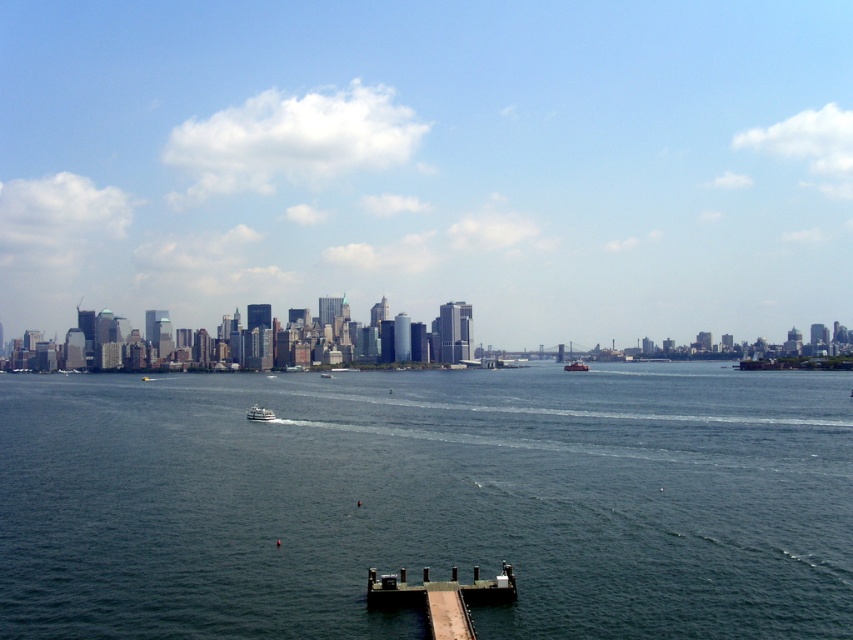
Who is taller, dark blue water at center or metallic gray ship at center?

Standing taller between the two is dark blue water at center.

How far apart are dark blue water at center and metallic gray ship at center?

dark blue water at center is 710.25 feet away from metallic gray ship at center.

The image size is (853, 640). Identify the location of dark blue water at center. (427, 500).

Is point (367, 424) farther from viewer compared to point (254, 406)?

That is False.

Is dark blue water at center below white glossy ferry at center?

No.

Which is in front, point (724, 468) or point (270, 410)?

Point (724, 468)

At what (x,y) coordinates should I click in order to perform the action: click on dark blue water at center. Please return your answer as a coordinate pair (x, y). This screenshot has width=853, height=640. Looking at the image, I should click on (427, 500).

Does brown wooden dock at lower center appear on the right side of white glossy ferry at center?

Yes, brown wooden dock at lower center is to the right of white glossy ferry at center.

Can you confirm if brown wooden dock at lower center is positioned below white glossy ferry at center?

Correct, brown wooden dock at lower center is located below white glossy ferry at center.

What are the coordinates of `brown wooden dock at lower center` in the screenshot? It's located at (440, 596).